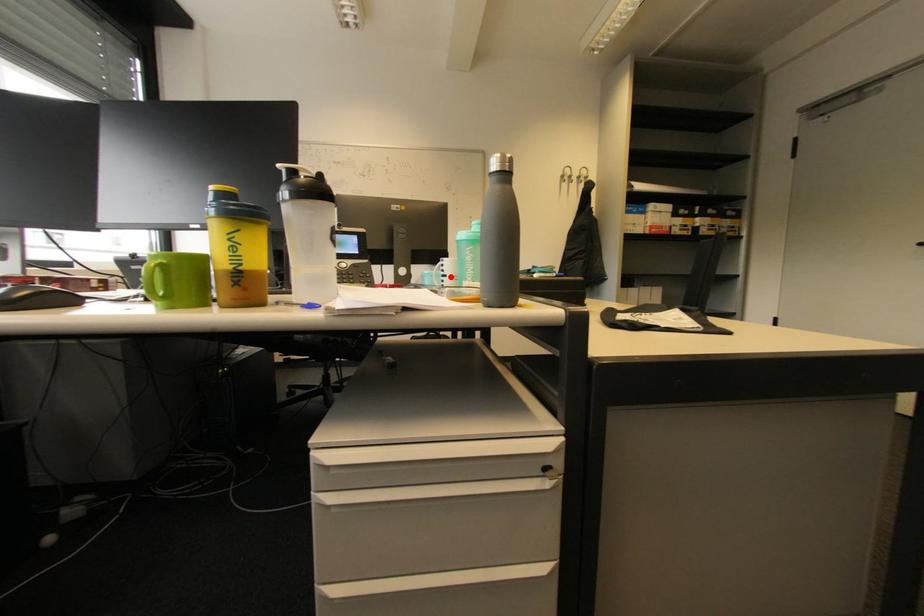
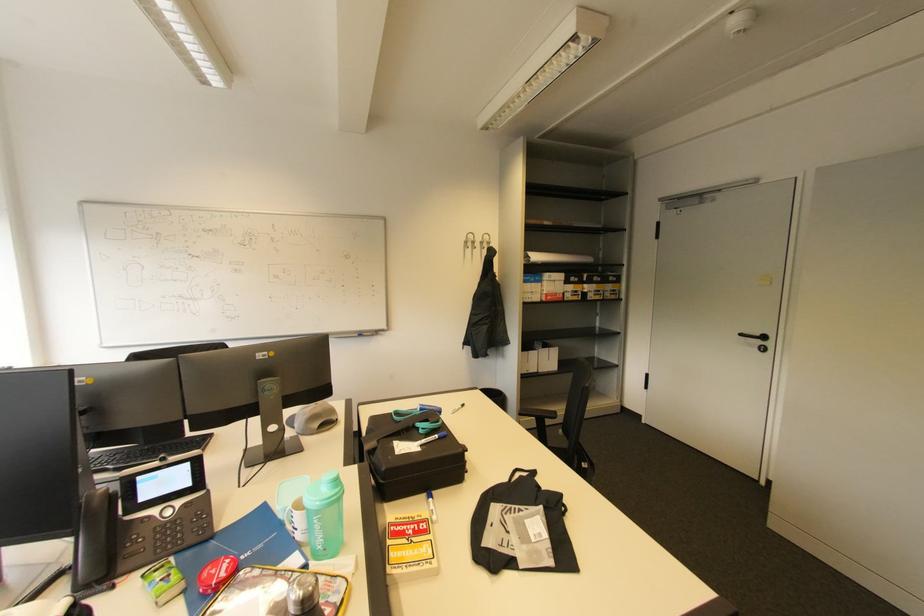
Find the pixel in the second image that matches the highlighted location in the first image.

(300, 531)